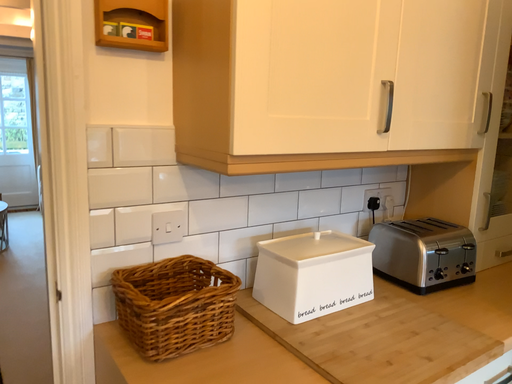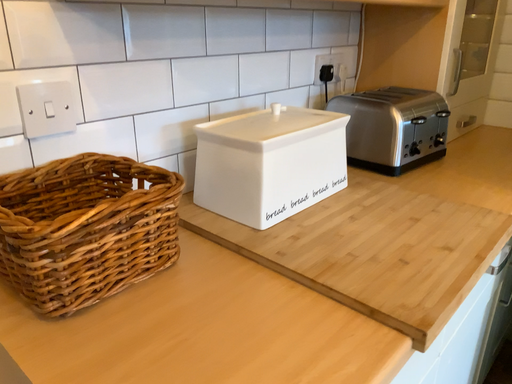
Question: How did the camera likely rotate when shooting the video?

Choices:
 (A) rotated left
 (B) rotated right

Answer: (B)